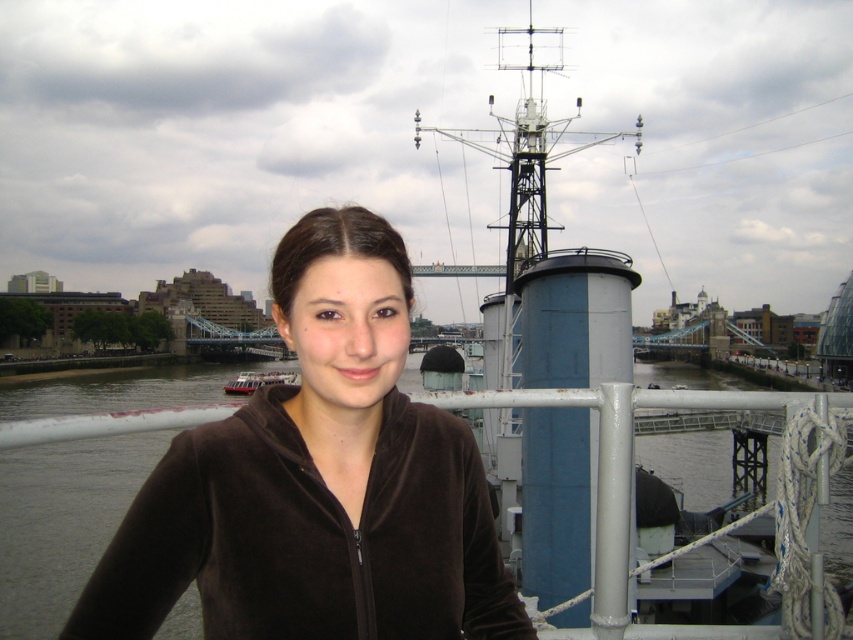
Question: Is brown velvety jacket at center below metallic silver boat at center?

Choices:
 (A) yes
 (B) no

Answer: (B)

Question: Which object is closer to the camera taking this photo?

Choices:
 (A) brown velvety jacket at center
 (B) metallic silver boat at center

Answer: (A)

Question: Which object is the farthest from the brown water at center?

Choices:
 (A) metallic silver boat at center
 (B) brown velvety jacket at center

Answer: (B)

Question: Can you confirm if brown velvety jacket at center is smaller than metallic silver boat at center?

Choices:
 (A) yes
 (B) no

Answer: (A)

Question: Which point is farther from the camera taking this photo?

Choices:
 (A) (286, 381)
 (B) (523, 637)
 (C) (90, 554)

Answer: (A)

Question: Does brown water at center appear on the left side of metallic silver boat at center?

Choices:
 (A) yes
 (B) no

Answer: (B)